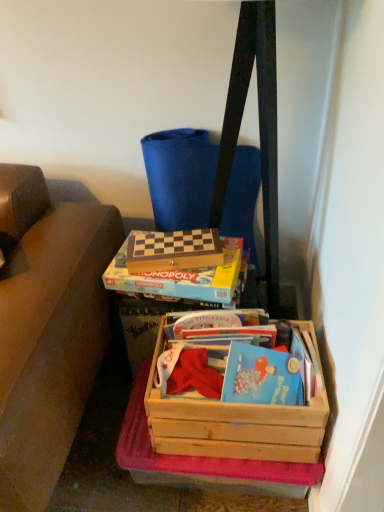
The width and height of the screenshot is (384, 512). In order to click on free space above wooden crate at lower right, positioned as the first box in bottom-to-top order (from a real-world perspective) in this screenshot , I will do `click(227, 357)`.